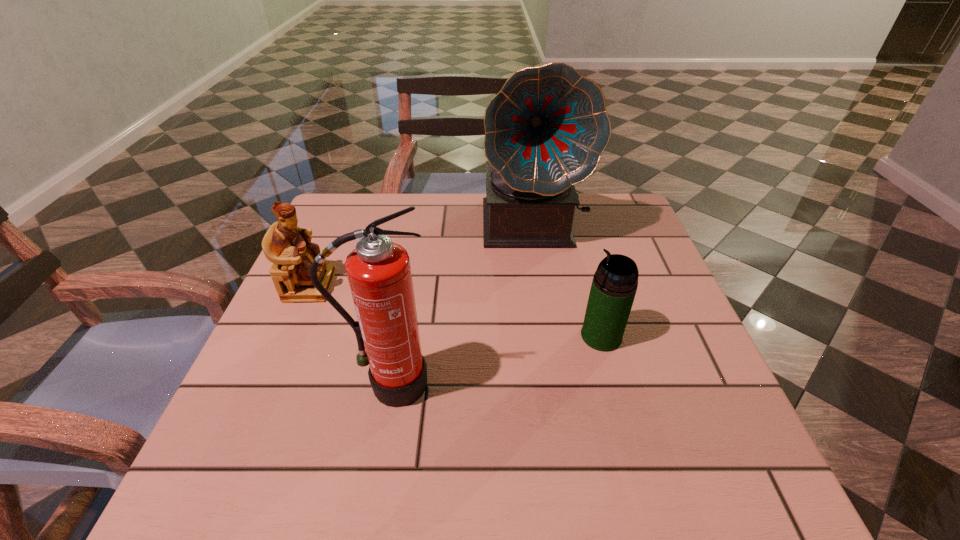
I want to click on unoccupied area between the thermos bottle and the figurine, so click(x=455, y=311).

Where is `free area in between the third farthest object and the second farthest object`? The height and width of the screenshot is (540, 960). free area in between the third farthest object and the second farthest object is located at coordinates (455, 311).

Locate which object is the second closest to the thermos bottle. Please provide its 2D coordinates. Your answer should be formatted as a tuple, i.e. [(x, y)], where the tuple contains the x and y coordinates of a point satisfying the conditions above.

[(379, 274)]

You are a GUI agent. You are given a task and a screenshot of the screen. Output one action in this format:
    pyautogui.click(x=<x>, y=<y>)
    Task: Click on the object that is the second closest to the figurine
    The width and height of the screenshot is (960, 540).
    Given the screenshot: What is the action you would take?
    [x=545, y=131]

Locate an element on the screen. vacant region that satisfies the following two spatial constraints: 1. on the horn of the record player; 2. on the front-facing side of the third nearest object is located at coordinates (542, 286).

You are a GUI agent. You are given a task and a screenshot of the screen. Output one action in this format:
    pyautogui.click(x=<x>, y=<y>)
    Task: Click on the vacant space that satisfies the following two spatial constraints: 1. from the spout of the thermos bottle; 2. on the front-facing side of the nearest object
    The image size is (960, 540).
    Given the screenshot: What is the action you would take?
    pyautogui.click(x=614, y=384)

You are a GUI agent. You are given a task and a screenshot of the screen. Output one action in this format:
    pyautogui.click(x=<x>, y=<y>)
    Task: Click on the free location that satisfies the following two spatial constraints: 1. on the horn of the farthest object; 2. on the front-facing side of the leftmost object
    
    Given the screenshot: What is the action you would take?
    pyautogui.click(x=542, y=286)

This screenshot has width=960, height=540. Identify the location of free spot that satisfies the following two spatial constraints: 1. from the spout of the second nearest object; 2. on the front-facing side of the third object from right to left. (614, 384).